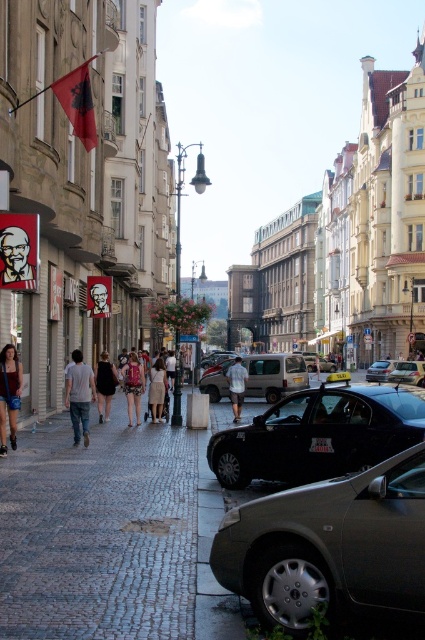
You are a delivery person standing on the cobblestone pavement at lower left, and you need to load a box onto the shiny black car at center. Considering the height difference between the two, would you need a ramp to safely load the box onto the car?

The cobblestone pavement at lower left has a greater height compared to the shiny black car at center. Since the pavement is higher than the car, you would need a ramp to safely lower the box onto the car without dropping it.

You are a tourist standing on the cobblestone pavement at lower left and want to reach the shiny black car at center. Which direction should you move to get there?

The cobblestone pavement at lower left is to the left of the shiny black car at center, so you should move to the right to reach the shiny black car at center.

In the scene shown: You are standing at the point labeled as point (99, 532) in the image. What is the surface you are currently standing on?

The surface you are currently standing on is the cobblestone pavement at lower left corresponding to point 0.8334, 0.233.